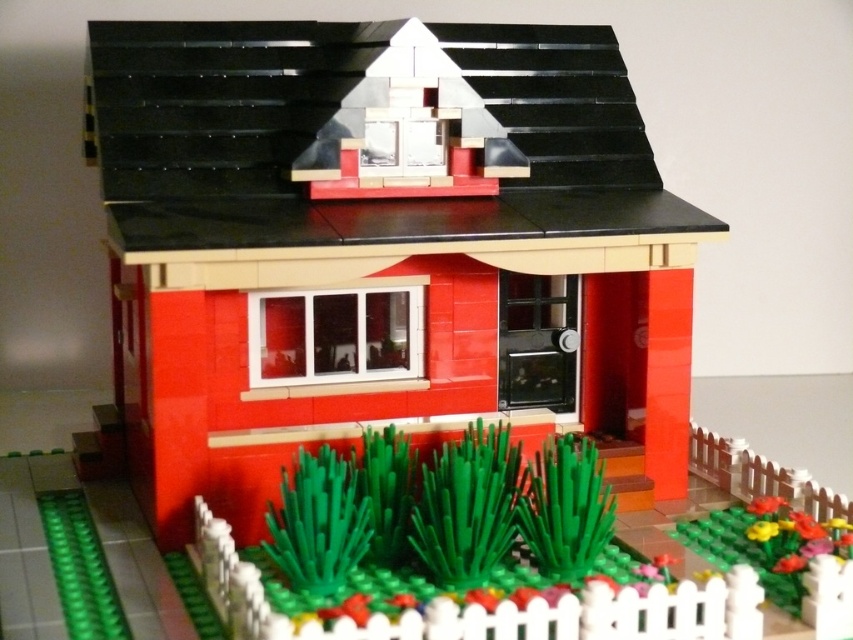
Question: Considering the relative positions of brick house at center and floral plastic flowers at lower right in the image provided, where is brick house at center located with respect to floral plastic flowers at lower right?

Choices:
 (A) right
 (B) left

Answer: (B)

Question: Is the position of brick house at center more distant than that of floral plastic flowers at lower right?

Choices:
 (A) yes
 (B) no

Answer: (A)

Question: Which point is closer to the camera?

Choices:
 (A) (173, 108)
 (B) (770, 525)

Answer: (B)

Question: Which object appears closest to the camera in this image?

Choices:
 (A) brick house at center
 (B) floral plastic flowers at lower right

Answer: (B)

Question: Can you confirm if brick house at center is positioned above floral plastic flowers at lower right?

Choices:
 (A) no
 (B) yes

Answer: (B)